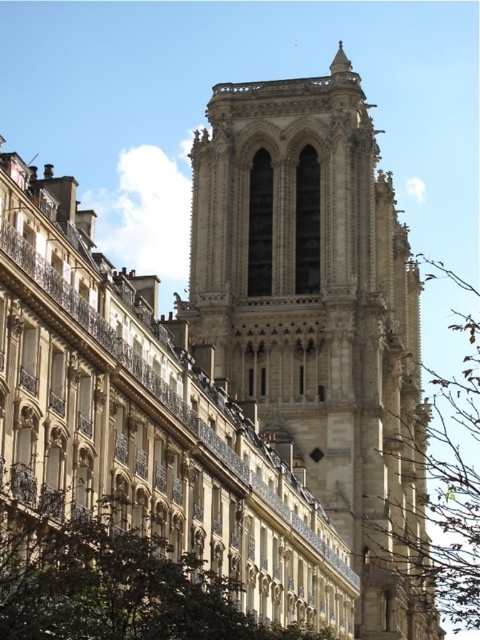
Based on the photo, based on the scene description, where is the beige stone tower at center located in the image?

The beige stone tower at center is located at point [319,316] in the image.

You are a city planner assessing green spaces in the area. You notice the green leafy tree at lower left and the brown leafy tree at right. Which tree is shorter?

The green leafy tree at lower left is shorter than the brown leafy tree at right.

From the picture: You are a city planner assessing the space between the green leafy tree at lower left and the brown leafy tree at right. If you want to install a new bench that requires at least 90 meters of space, will there be enough room?

The distance between the green leafy tree at lower left and the brown leafy tree at right is 87.62 meters, which is less than the required 90 meters. Therefore, there is not enough space to install the bench.